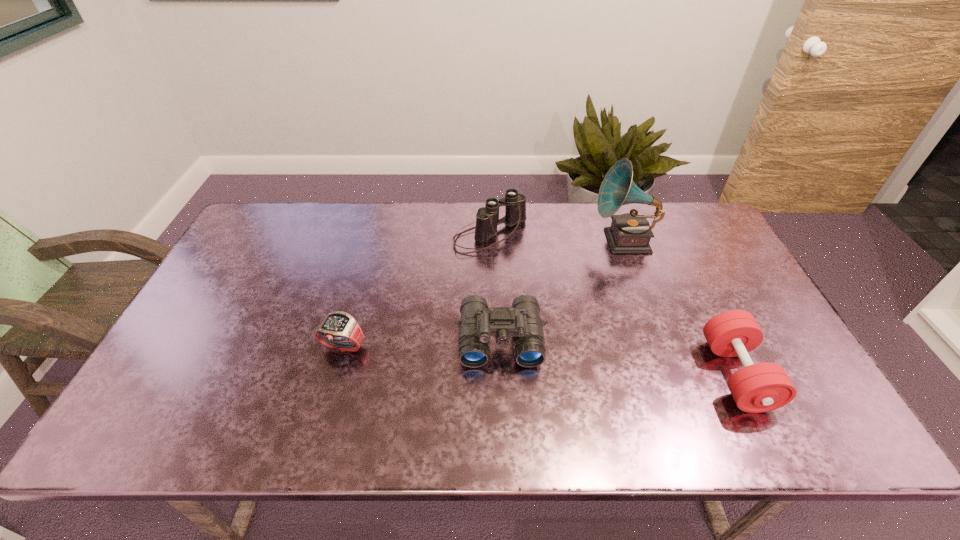
At what (x,y) coordinates should I click in order to perform the action: click on the tallest object. Please return your answer as a coordinate pair (x, y). The image size is (960, 540). Looking at the image, I should click on (629, 233).

You are a GUI agent. You are given a task and a screenshot of the screen. Output one action in this format:
    pyautogui.click(x=<x>, y=<y>)
    Task: Click on the farther binoculars
    This screenshot has height=540, width=960.
    Given the screenshot: What is the action you would take?
    pyautogui.click(x=487, y=218)

Locate an element on the screen. The image size is (960, 540). the nearer binoculars is located at coordinates (478, 322).

You are a GUI agent. You are given a task and a screenshot of the screen. Output one action in this format:
    pyautogui.click(x=<x>, y=<y>)
    Task: Click on the dumbbell
    The width and height of the screenshot is (960, 540).
    Given the screenshot: What is the action you would take?
    pyautogui.click(x=762, y=387)

Where is `the shortest object`? This screenshot has height=540, width=960. the shortest object is located at coordinates (339, 331).

The width and height of the screenshot is (960, 540). What are the coordinates of `watch` in the screenshot? It's located at (339, 331).

Identify the location of vacant region located 0.200m from the horn of the phonograph_record. The height and width of the screenshot is (540, 960). (531, 241).

Where is `free space located from the horn of the phonograph_record`? The image size is (960, 540). free space located from the horn of the phonograph_record is located at coordinates (577, 241).

The image size is (960, 540). I want to click on free point located 0.200m from the horn of the phonograph_record, so click(x=531, y=241).

The width and height of the screenshot is (960, 540). In order to click on vacant point located on the left of the farther binoculars in this screenshot , I will do `click(345, 236)`.